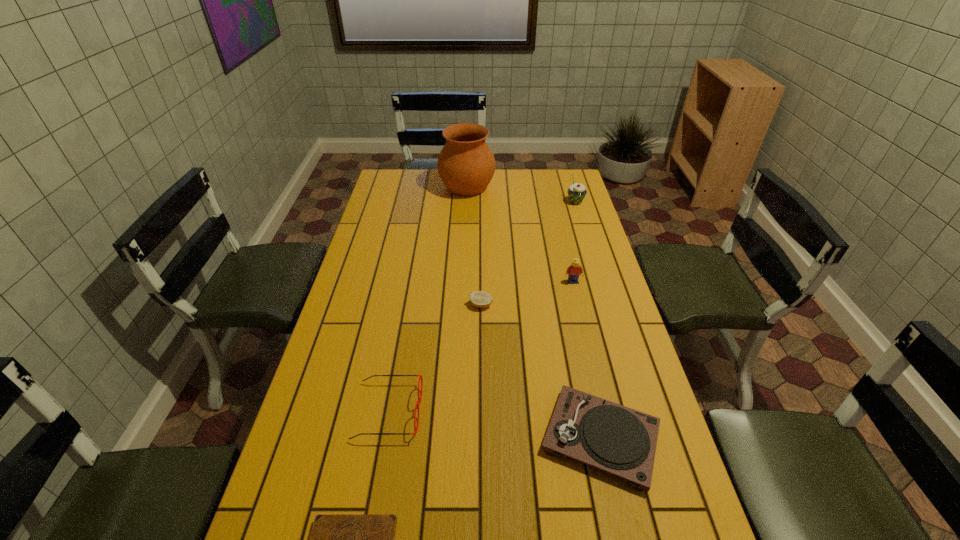
This screenshot has width=960, height=540. In order to click on free space located 0.210m on the front-facing side of the fifth shortest object in this screenshot , I will do `click(585, 330)`.

The height and width of the screenshot is (540, 960). Find the location of `vacant space located 0.220m on the front-facing side of the spectacles`. vacant space located 0.220m on the front-facing side of the spectacles is located at coordinates (506, 411).

This screenshot has width=960, height=540. I want to click on vacant space situated 0.150m on the left of the phonograph_record, so click(477, 438).

Locate an element on the screen. free region located 0.090m on the right of the lemon is located at coordinates (521, 305).

In order to click on object that is at the far edge in this screenshot , I will do `click(466, 165)`.

Where is `object that is at the left edge`? This screenshot has height=540, width=960. object that is at the left edge is located at coordinates (419, 399).

In order to click on cupcake that is positioned at the right edge in this screenshot , I will do `click(576, 192)`.

Locate an element on the screen. Image resolution: width=960 pixels, height=540 pixels. Lego at the right edge is located at coordinates (574, 270).

What are the coordinates of `phonograph_record situated at the right edge` in the screenshot? It's located at (611, 437).

Image resolution: width=960 pixels, height=540 pixels. In the image, there is a desktop. In order to click on vacant region at the far edge in this screenshot , I will do `click(526, 189)`.